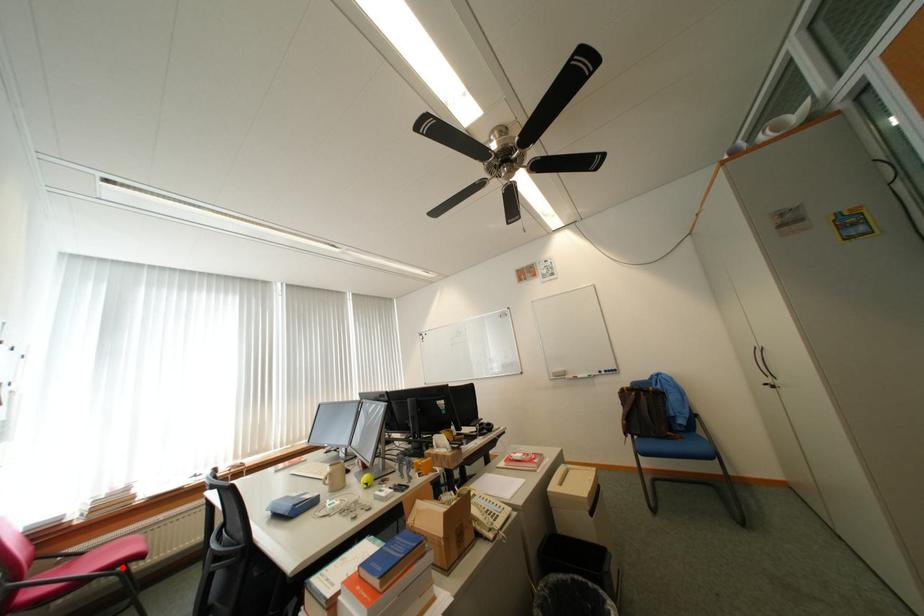
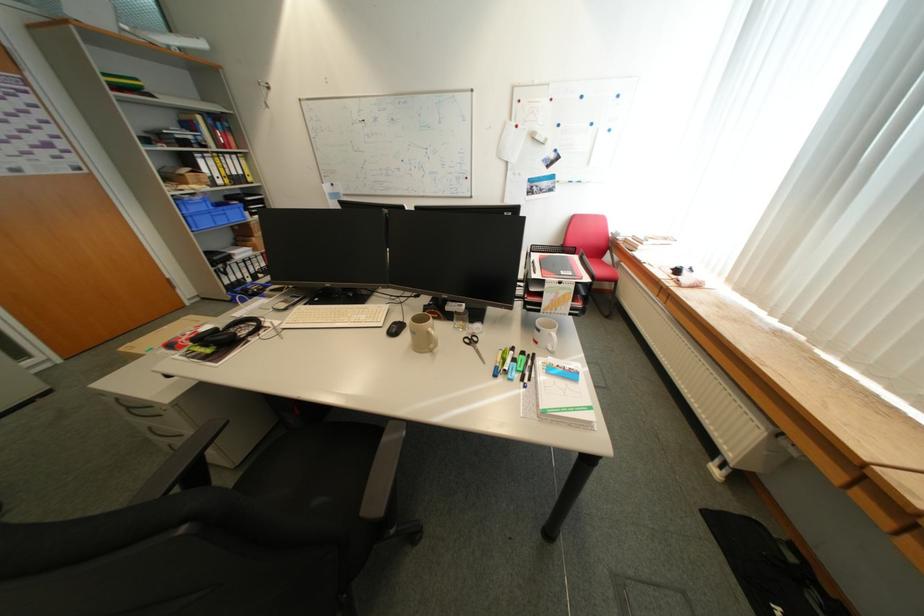
Question: I am providing you with two images of the same scene from different viewpoints. A red point is marked on the first image. At the location where the point appears in image 1, is it still visible in image 2?

Choices:
 (A) Yes
 (B) No

Answer: (B)